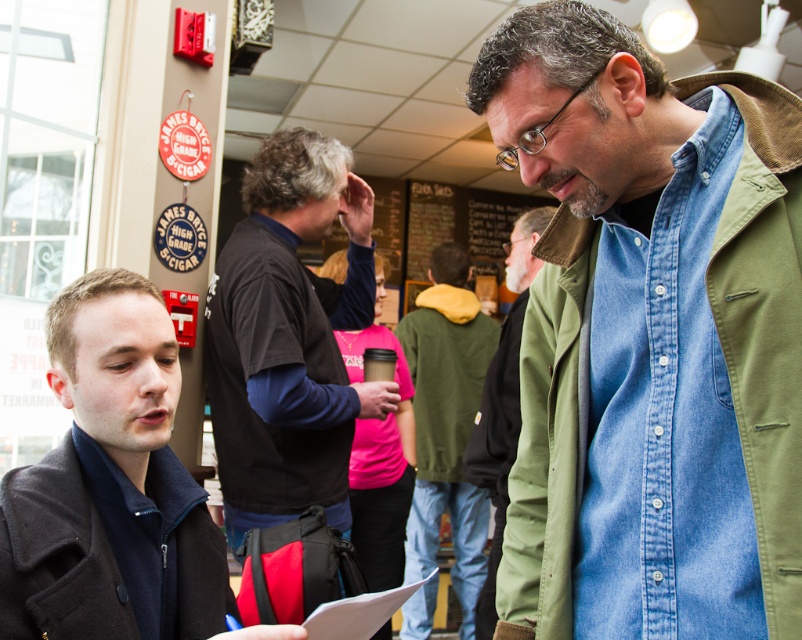
You are a customer trying to decide between two jackets displayed at the center of the store. The denim shirt at center is worn by a man on the left, and the black softshell jacket at center is worn by the man to his right. Which jacket reaches lower on the body?

The black softshell jacket at center reaches lower on the body since it is taller than the denim shirt at center.

Based on the photo, you are a fashion designer observing two coats in the scene. The dark gray wool coat at lower left and the black wool coat at lower left. Which one is taller?

The dark gray wool coat at lower left is taller than the black wool coat at lower left.